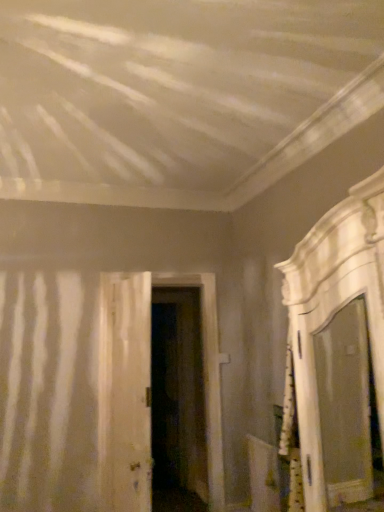
Question: From the image's perspective, is white glossy mirror at right on white wood door at center, which is the second door from back to front?

Choices:
 (A) no
 (B) yes

Answer: (B)

Question: Is white glossy mirror at right in front of white wood door at center, which is the second door from back to front?

Choices:
 (A) no
 (B) yes

Answer: (B)

Question: From a real-world perspective, is white glossy mirror at right located beneath white wood door at center, which ranks as the 2th door in front-to-back order?

Choices:
 (A) no
 (B) yes

Answer: (A)

Question: From the image's perspective, is white glossy mirror at right beneath white wood door at center, which ranks as the 2th door in front-to-back order?

Choices:
 (A) yes
 (B) no

Answer: (B)

Question: Does white glossy mirror at right appear on the left side of white wood door at center, which ranks as the 2th door in front-to-back order?

Choices:
 (A) no
 (B) yes

Answer: (A)

Question: Relative to white glossy mirror at right, is dark wood door at center, the third door from the front, in front or behind?

Choices:
 (A) front
 (B) behind

Answer: (B)

Question: Considering the positions of point (165, 288) and point (289, 361), is point (165, 288) closer or farther from the camera than point (289, 361)?

Choices:
 (A) closer
 (B) farther

Answer: (B)

Question: From a real-world perspective, relative to white glossy mirror at right, is dark wood door at center, placed as the first door when sorted from back to front, vertically above or below?

Choices:
 (A) above
 (B) below

Answer: (B)

Question: From the image's perspective, is dark wood door at center, placed as the first door when sorted from back to front, positioned above or below white glossy mirror at right?

Choices:
 (A) above
 (B) below

Answer: (B)

Question: In the image, is white wood door at center, arranged as the third door when viewed from the back, positioned in front of or behind white wood door at center, which ranks as the 2th door in front-to-back order?

Choices:
 (A) front
 (B) behind

Answer: (A)

Question: Looking at their shapes, would you say white wood door at center, marked as the 1th door in a front-to-back arrangement, is wider or thinner than white wood door at center, which is the second door from back to front?

Choices:
 (A) wide
 (B) thin

Answer: (B)

Question: Is white wood door at center, arranged as the third door when viewed from the back, taller or shorter than white wood door at center, which is the second door from back to front?

Choices:
 (A) short
 (B) tall

Answer: (A)

Question: Would you say white wood door at center, arranged as the third door when viewed from the back, is to the left or to the right of white wood door at center, which is the second door from back to front, in the picture?

Choices:
 (A) right
 (B) left

Answer: (B)

Question: Considering the relative positions of white wood door at center, arranged as the third door when viewed from the back, and white glossy mirror at right in the image provided, is white wood door at center, arranged as the third door when viewed from the back, to the left or to the right of white glossy mirror at right?

Choices:
 (A) right
 (B) left

Answer: (B)

Question: Looking at their shapes, would you say white wood door at center, arranged as the third door when viewed from the back, is wider or thinner than white glossy mirror at right?

Choices:
 (A) wide
 (B) thin

Answer: (B)